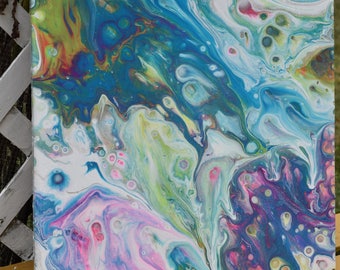
The height and width of the screenshot is (270, 340). In order to click on white plank in this screenshot , I will do `click(17, 194)`, `click(8, 90)`.